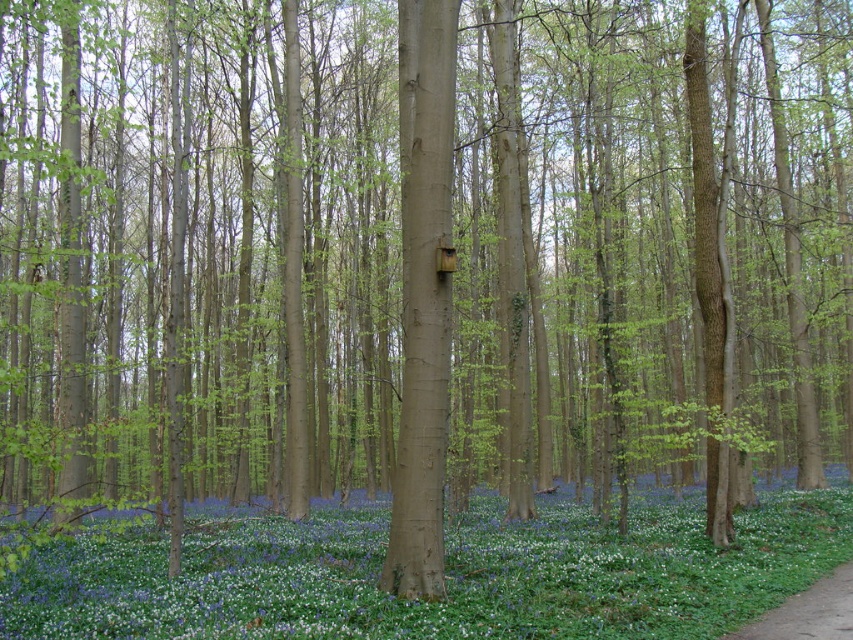
Question: Is blue matte flower at center positioned in front of brown dirt path at lower right?

Choices:
 (A) no
 (B) yes

Answer: (A)

Question: From the image, what is the correct spatial relationship of blue matte flower at center in relation to brown dirt path at lower right?

Choices:
 (A) left
 (B) right

Answer: (A)

Question: Which of the following is the farthest from the observer?

Choices:
 (A) (837, 589)
 (B) (749, 616)

Answer: (A)

Question: Where is blue matte flower at center located in relation to brown dirt path at lower right in the image?

Choices:
 (A) left
 (B) right

Answer: (A)

Question: Among these points, which one is farthest from the camera?

Choices:
 (A) (837, 625)
 (B) (785, 554)

Answer: (B)

Question: Which point is farther to the camera?

Choices:
 (A) (729, 637)
 (B) (257, 541)

Answer: (B)